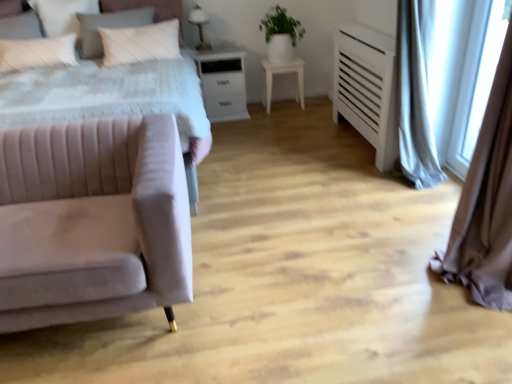
Question: Is white matte table at center not inside white quilted pillow at upper left, acting as the second pillow starting from the left?

Choices:
 (A) no
 (B) yes

Answer: (B)

Question: Does white matte table at center have a lesser height compared to white quilted pillow at upper left, acting as the second pillow starting from the left?

Choices:
 (A) no
 (B) yes

Answer: (B)

Question: Is white matte table at center behind white quilted pillow at upper left, acting as the second pillow starting from the left?

Choices:
 (A) no
 (B) yes

Answer: (B)

Question: Is white quilted pillow at upper left, acting as the second pillow starting from the left, inside white matte table at center?

Choices:
 (A) no
 (B) yes

Answer: (A)

Question: Is white matte table at center to the left of white quilted pillow at upper left, acting as the second pillow starting from the left, from the viewer's perspective?

Choices:
 (A) yes
 (B) no

Answer: (B)

Question: Is white matte table at center wider or thinner than green matte plant at upper center?

Choices:
 (A) thin
 (B) wide

Answer: (A)

Question: Is white matte table at center in front of or behind green matte plant at upper center in the image?

Choices:
 (A) front
 (B) behind

Answer: (B)

Question: Is white matte table at center inside or outside of green matte plant at upper center?

Choices:
 (A) inside
 (B) outside

Answer: (B)

Question: Considering the positions of white matte table at center and green matte plant at upper center in the image, is white matte table at center taller or shorter than green matte plant at upper center?

Choices:
 (A) tall
 (B) short

Answer: (B)

Question: From the image's perspective, relative to white glossy table lamp at upper center, is velvet pink couch at left above or below?

Choices:
 (A) above
 (B) below

Answer: (B)

Question: Is velvet pink couch at left taller or shorter than white glossy table lamp at upper center?

Choices:
 (A) short
 (B) tall

Answer: (B)

Question: Would you say velvet pink couch at left is to the left or to the right of white glossy table lamp at upper center in the picture?

Choices:
 (A) right
 (B) left

Answer: (B)

Question: Is point (184, 281) positioned closer to the camera than point (196, 19)?

Choices:
 (A) closer
 (B) farther

Answer: (A)

Question: Considering the positions of white matte table at center and white glossy table lamp at upper center in the image, is white matte table at center wider or thinner than white glossy table lamp at upper center?

Choices:
 (A) wide
 (B) thin

Answer: (A)

Question: From the image's perspective, is white matte table at center above or below white glossy table lamp at upper center?

Choices:
 (A) above
 (B) below

Answer: (B)